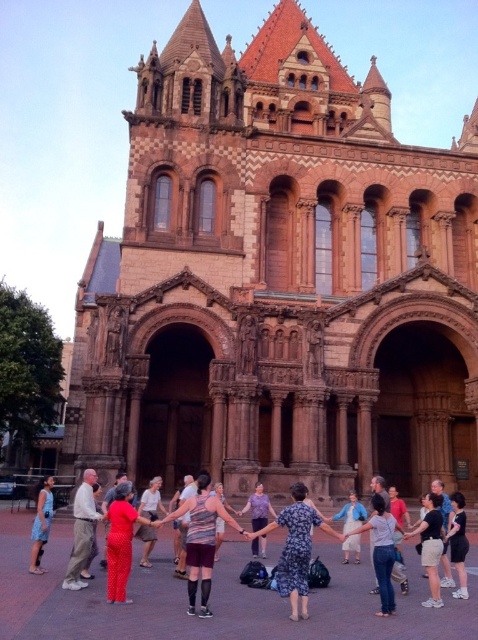
Question: From the image, what is the correct spatial relationship of light brown cotton pants at center in relation to black fabric dress at lower right?

Choices:
 (A) left
 (B) right

Answer: (A)

Question: Which point is closer to the camera?

Choices:
 (A) black fabric dress at lower right
 (B) floral dress at center
 (C) light brown cotton pants at center

Answer: (B)

Question: Does light brown cotton pants at center have a greater width compared to purple cotton shirt at center?

Choices:
 (A) no
 (B) yes

Answer: (B)

Question: Does light brown cotton pants at center appear on the left side of purple cotton shirt at center?

Choices:
 (A) yes
 (B) no

Answer: (A)

Question: Considering the real-world distances, which object is closest to the blue denim dress at center?

Choices:
 (A) purple cotton shirt at center
 (B) matte red dress at center

Answer: (A)

Question: Among these points, which one is farthest from the camera?

Choices:
 (A) (345, 548)
 (B) (191, 557)

Answer: (A)